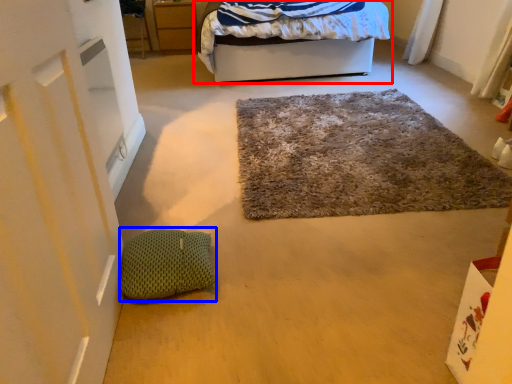
Question: Among these objects, which one is farthest to the camera, bed (highlighted by a red box) or pillow (highlighted by a blue box)?

Choices:
 (A) bed
 (B) pillow

Answer: (A)